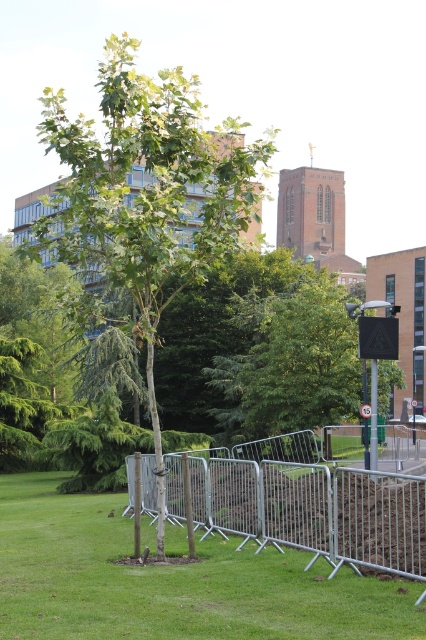
You are a city planner analyzing the urban space. You see the green grass at center and the green leafy tree at center. Which one takes up more space in the scene?

The green leafy tree at center takes up more space than the green grass at center because the grass has a smaller size compared to the tree.

You are a city planner assessing the urban space. You notice the green grass at center and the green leafy tree at center. Which one has a greater height?

The green leafy tree at center is taller than the green grass at center.